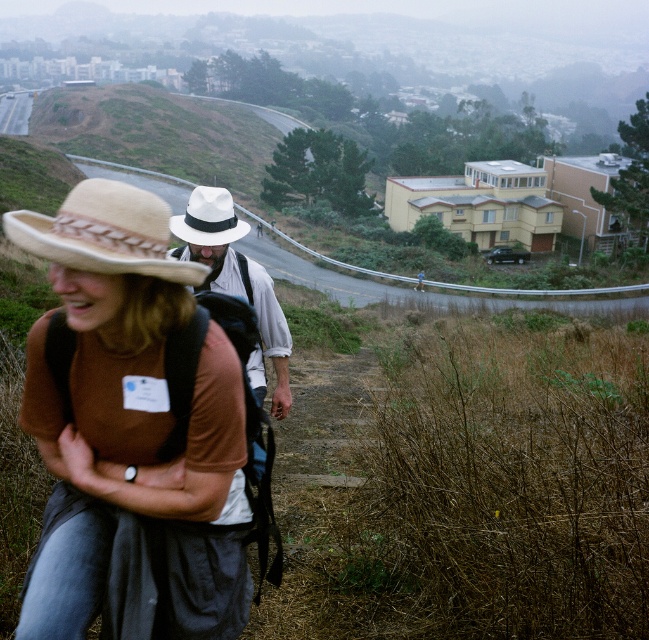
You are a hiker who just found a lost item on the trail. The item is the beige straw cowboy hat at center. If you want to place it on a nearby bench that is 2 meters away from you, will you have to walk more than 2 meters to reach it?

The beige straw cowboy hat at center is 1.69 meters away from viewer. Since the bench is 2 meters away from you, you would need to walk 2 meters to reach the bench, which is farther than the distance to the hat. Therefore, you will have to walk more than 1.69 meters but exactly 2 meters to place the hat on the bench.

Looking at this image, you are a photographer trying to capture both the beige straw cowboy hat at center and the white felt cowboy hat at center in a single frame. Based on their sizes in the image, which hat would appear smaller?

The beige straw cowboy hat at center appears smaller because it occupies less space than the white felt cowboy hat at center.

You are a hiker who wants to identify clothing items based on their width. You see a matte brown shirt at center and a beige straw cowboy hat at center. Which clothing item is narrower?

The matte brown shirt at center is thinner than the beige straw cowboy hat at center, so the matte brown shirt at center is narrower.